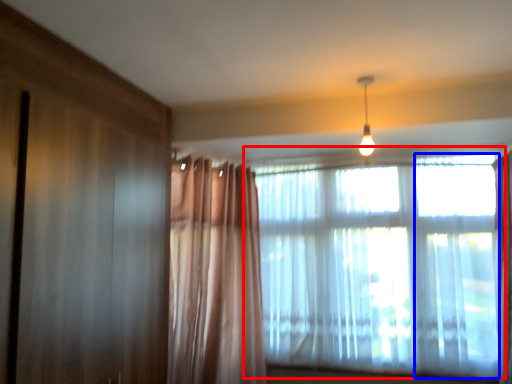
Question: Which object is further to the camera taking this photo, window (highlighted by a red box) or window (highlighted by a blue box)?

Choices:
 (A) window
 (B) window

Answer: (A)